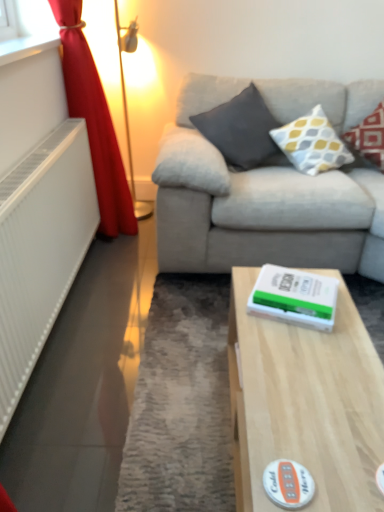
You are a GUI agent. You are given a task and a screenshot of the screen. Output one action in this format:
    pyautogui.click(x=<x>, y=<y>)
    Task: Click on the vacant area to the right of white matte sticker at lower center
    The width and height of the screenshot is (384, 512).
    Given the screenshot: What is the action you would take?
    pyautogui.click(x=347, y=464)